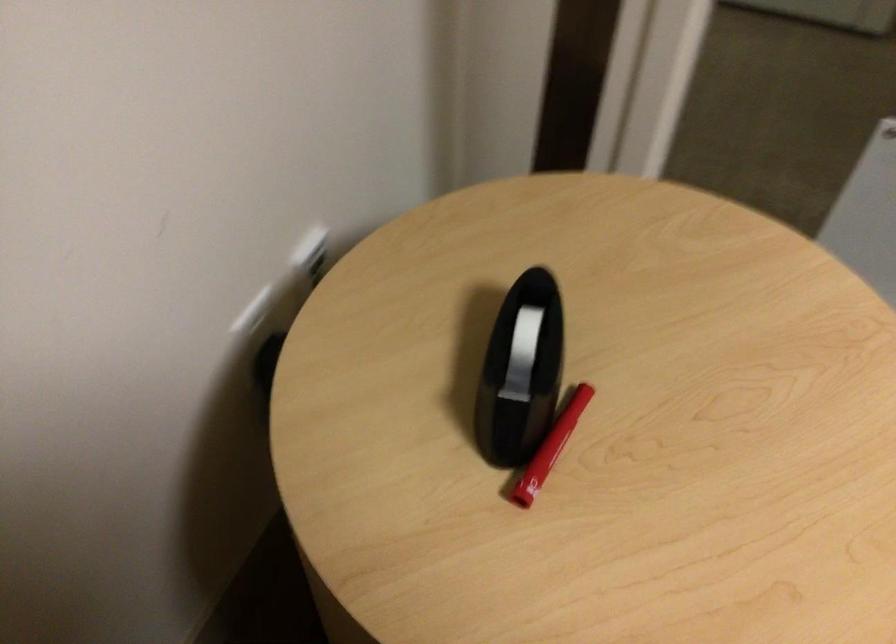
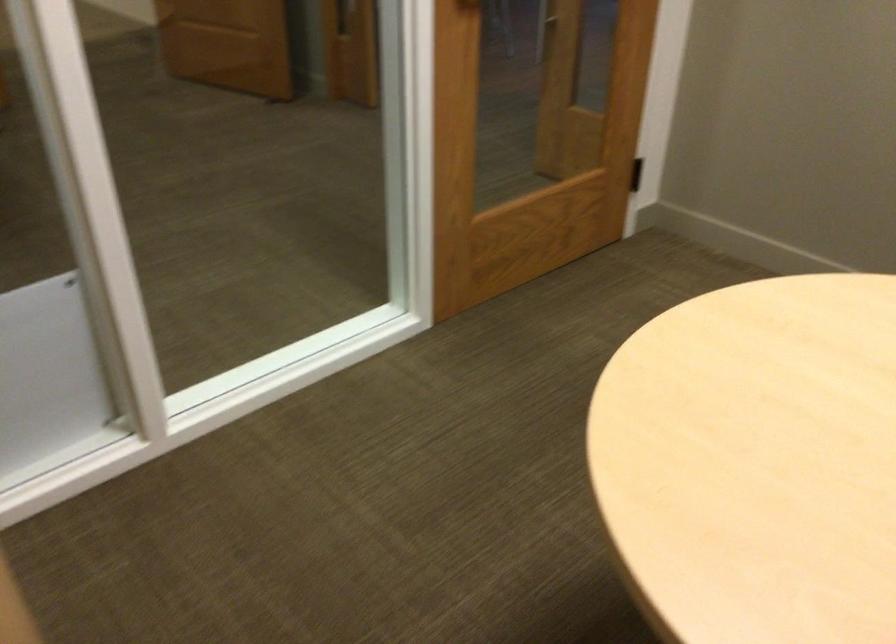
Question: Based on the continuous images, in which direction is the camera rotating? Reply with the corresponding letter.

Choices:
 (A) Left
 (B) Right
 (C) Up
 (D) Down

Answer: (B)